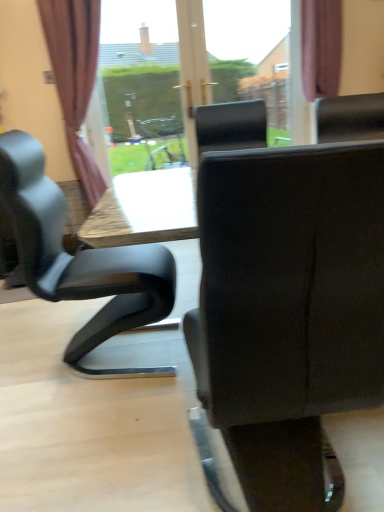
This screenshot has width=384, height=512. What do you see at coordinates (321, 47) in the screenshot? I see `purple fabric curtain at upper right, which is the 2th curtain from left to right` at bounding box center [321, 47].

The width and height of the screenshot is (384, 512). I want to click on purple fabric curtain at upper right, arranged as the 1th curtain when viewed from the right, so click(321, 47).

What do you see at coordinates (75, 78) in the screenshot?
I see `brown fabric curtain at left, placed as the 2th curtain when sorted from right to left` at bounding box center [75, 78].

You are a GUI agent. You are given a task and a screenshot of the screen. Output one action in this format:
    pyautogui.click(x=<x>, y=<y>)
    Task: Click on the matte black chair at center
    The width and height of the screenshot is (384, 512).
    Given the screenshot: What is the action you would take?
    pyautogui.click(x=288, y=309)

Considering the sizes of purple fabric curtain at upper right, arranged as the 1th curtain when viewed from the right, and matte black chair at center in the image, is purple fabric curtain at upper right, arranged as the 1th curtain when viewed from the right, taller or shorter than matte black chair at center?

purple fabric curtain at upper right, arranged as the 1th curtain when viewed from the right, is shorter than matte black chair at center.

Are purple fabric curtain at upper right, which is the 2th curtain from left to right, and matte black chair at center making contact?

purple fabric curtain at upper right, which is the 2th curtain from left to right, is not next to matte black chair at center, and they're not touching.

Image resolution: width=384 pixels, height=512 pixels. In order to click on curtain that is the 2nd one when counting backward from the matte black chair at center in this screenshot , I will do `click(321, 47)`.

Which is farther from the camera, [84,185] or [194,426]?

Positioned behind is point [84,185].

Is brown fabric curtain at left, the 1th curtain from the left, situated inside matte black chair at center or outside?

brown fabric curtain at left, the 1th curtain from the left, exists outside the volume of matte black chair at center.

Considering the relative sizes of brown fabric curtain at left, placed as the 2th curtain when sorted from right to left, and matte black chair at center in the image provided, is brown fabric curtain at left, placed as the 2th curtain when sorted from right to left, wider than matte black chair at center?

No, brown fabric curtain at left, placed as the 2th curtain when sorted from right to left, is not wider than matte black chair at center.

Does brown fabric curtain at left, the 1th curtain from the left, turn towards matte black chair at center?

Yes, brown fabric curtain at left, the 1th curtain from the left, is aimed at matte black chair at center.

Does brown fabric curtain at left, the 1th curtain from the left, have a greater width compared to purple fabric curtain at upper right, arranged as the 1th curtain when viewed from the right?

Yes.

Which of these two, brown fabric curtain at left, placed as the 2th curtain when sorted from right to left, or purple fabric curtain at upper right, which is the 2th curtain from left to right, stands shorter?

purple fabric curtain at upper right, which is the 2th curtain from left to right, is shorter.

Is brown fabric curtain at left, placed as the 2th curtain when sorted from right to left, far away from purple fabric curtain at upper right, arranged as the 1th curtain when viewed from the right?

brown fabric curtain at left, placed as the 2th curtain when sorted from right to left, is positioned a significant distance from purple fabric curtain at upper right, arranged as the 1th curtain when viewed from the right.

Is matte black chair at center turned away from purple fabric curtain at upper right, which is the 2th curtain from left to right?

No, matte black chair at center is not facing the opposite direction of purple fabric curtain at upper right, which is the 2th curtain from left to right.

Is the position of matte black chair at center more distant than that of purple fabric curtain at upper right, arranged as the 1th curtain when viewed from the right?

No, matte black chair at center is in front of purple fabric curtain at upper right, arranged as the 1th curtain when viewed from the right.

Locate an element on the screen. The width and height of the screenshot is (384, 512). chair in front of the purple fabric curtain at upper right, which is the 2th curtain from left to right is located at coordinates (288, 309).

Which object is thinner, purple fabric curtain at upper right, which is the 2th curtain from left to right, or brown fabric curtain at left, the 1th curtain from the left?

With smaller width is purple fabric curtain at upper right, which is the 2th curtain from left to right.

Between purple fabric curtain at upper right, arranged as the 1th curtain when viewed from the right, and brown fabric curtain at left, the 1th curtain from the left, which one appears on the left side from the viewer's perspective?

From the viewer's perspective, brown fabric curtain at left, the 1th curtain from the left, appears more on the left side.

Between point (339, 73) and point (96, 1), which one is positioned in front?

Point (96, 1)

Is purple fabric curtain at upper right, arranged as the 1th curtain when viewed from the right, shorter than brown fabric curtain at left, the 1th curtain from the left?

Correct, purple fabric curtain at upper right, arranged as the 1th curtain when viewed from the right, is not as tall as brown fabric curtain at left, the 1th curtain from the left.

Does matte black chair at center have a greater width compared to brown fabric curtain at left, placed as the 2th curtain when sorted from right to left?

Indeed, matte black chair at center has a greater width compared to brown fabric curtain at left, placed as the 2th curtain when sorted from right to left.

Considering the positions of points (274, 248) and (65, 69), is point (274, 248) farther from camera compared to point (65, 69)?

No, it is in front of (65, 69).

Which object is positioned more to the left, matte black chair at center or brown fabric curtain at left, placed as the 2th curtain when sorted from right to left?

Positioned to the left is brown fabric curtain at left, placed as the 2th curtain when sorted from right to left.

From the image's perspective, who appears lower, matte black chair at center or brown fabric curtain at left, the 1th curtain from the left?

matte black chair at center.

Where is `the 2nd curtain behind the matte black chair at center`? the 2nd curtain behind the matte black chair at center is located at coordinates (321, 47).

The image size is (384, 512). I want to click on chair below the brown fabric curtain at left, placed as the 2th curtain when sorted from right to left (from the image's perspective), so click(288, 309).

Which object lies further to the anchor point brown fabric curtain at left, placed as the 2th curtain when sorted from right to left, purple fabric curtain at upper right, which is the 2th curtain from left to right, or matte black chair at center?

Based on the image, matte black chair at center appears to be further to brown fabric curtain at left, placed as the 2th curtain when sorted from right to left.

When comparing their distances from purple fabric curtain at upper right, arranged as the 1th curtain when viewed from the right, does matte black chair at center or brown fabric curtain at left, placed as the 2th curtain when sorted from right to left, seem further?

Among the two, matte black chair at center is located further to purple fabric curtain at upper right, arranged as the 1th curtain when viewed from the right.

Considering their positions, is brown fabric curtain at left, the 1th curtain from the left, positioned further to purple fabric curtain at upper right, arranged as the 1th curtain when viewed from the right, than matte black chair at center?

matte black chair at center lies further to purple fabric curtain at upper right, arranged as the 1th curtain when viewed from the right, than the other object.

Looking at the image, which one is located closer to matte black chair at center, brown fabric curtain at left, the 1th curtain from the left, or purple fabric curtain at upper right, arranged as the 1th curtain when viewed from the right?

A: Among the two, brown fabric curtain at left, the 1th curtain from the left, is located nearer to matte black chair at center.

From the image, which object appears to be farther from matte black chair at center, purple fabric curtain at upper right, which is the 2th curtain from left to right, or brown fabric curtain at left, placed as the 2th curtain when sorted from right to left?

Among the two, purple fabric curtain at upper right, which is the 2th curtain from left to right, is located further to matte black chair at center.

Which object lies nearer to the anchor point brown fabric curtain at left, the 1th curtain from the left, matte black chair at center or purple fabric curtain at upper right, arranged as the 1th curtain when viewed from the right?

Based on the image, purple fabric curtain at upper right, arranged as the 1th curtain when viewed from the right, appears to be nearer to brown fabric curtain at left, the 1th curtain from the left.

Where is `curtain between matte black chair at center and purple fabric curtain at upper right, which is the 2th curtain from left to right, from front to back`? curtain between matte black chair at center and purple fabric curtain at upper right, which is the 2th curtain from left to right, from front to back is located at coordinates (75, 78).